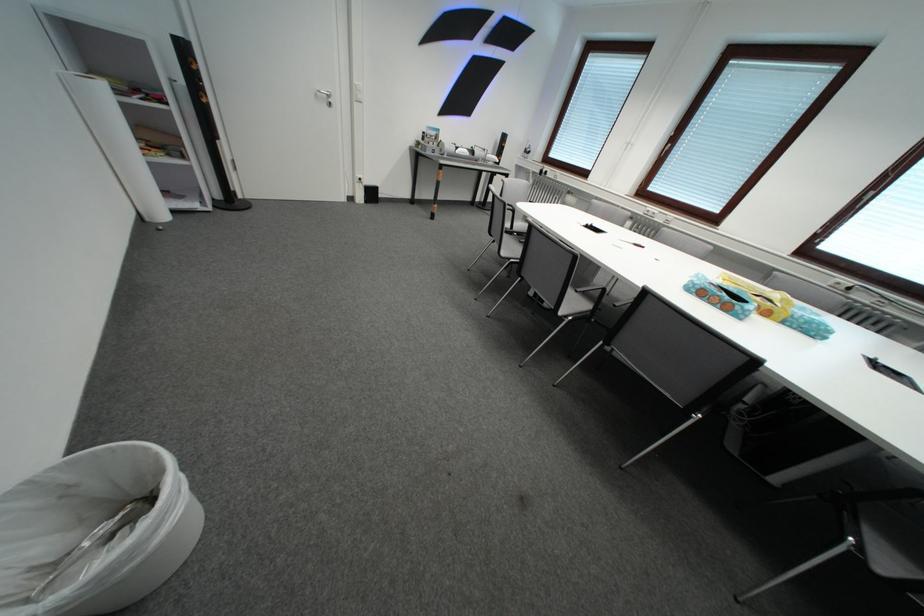
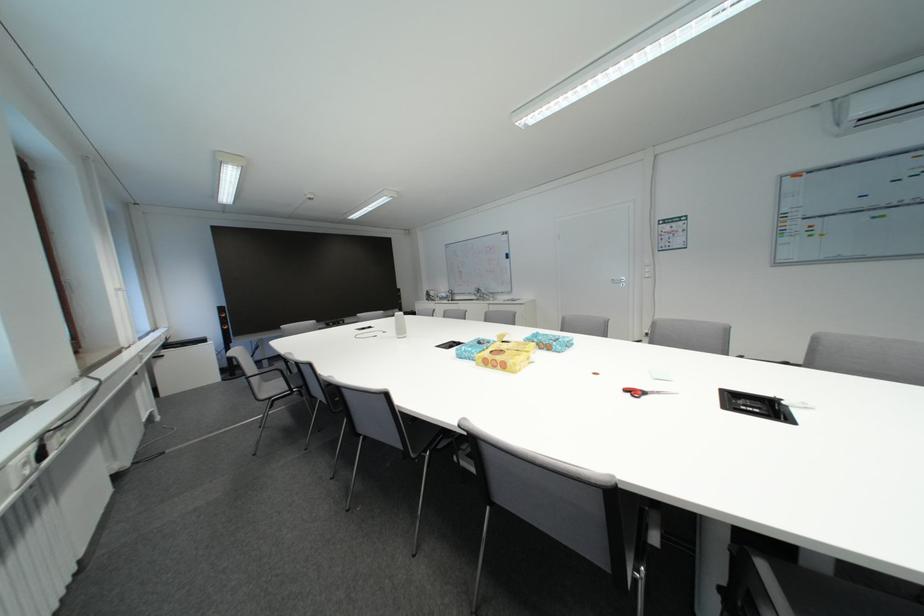
Question: I am providing you with two images of the same scene from different viewpoints. Which of the following objects are not visible in image2?

Choices:
 (A) grey chair sitting surface
 (B) silver door handle
 (C) black outlet cover
 (D) metal lid handle

Answer: (A)